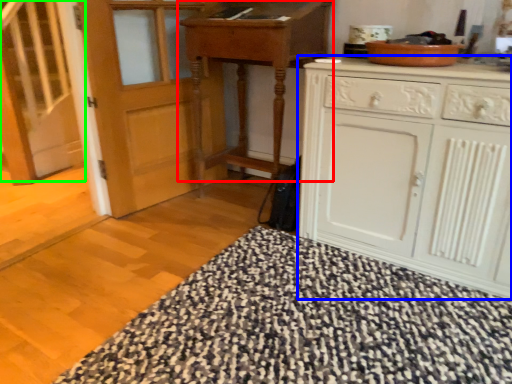
Question: Which object is the farthest from table (highlighted by a red box)? Choose among these: cabinetry (highlighted by a blue box) or stairs (highlighted by a green box).

Choices:
 (A) cabinetry
 (B) stairs

Answer: (B)